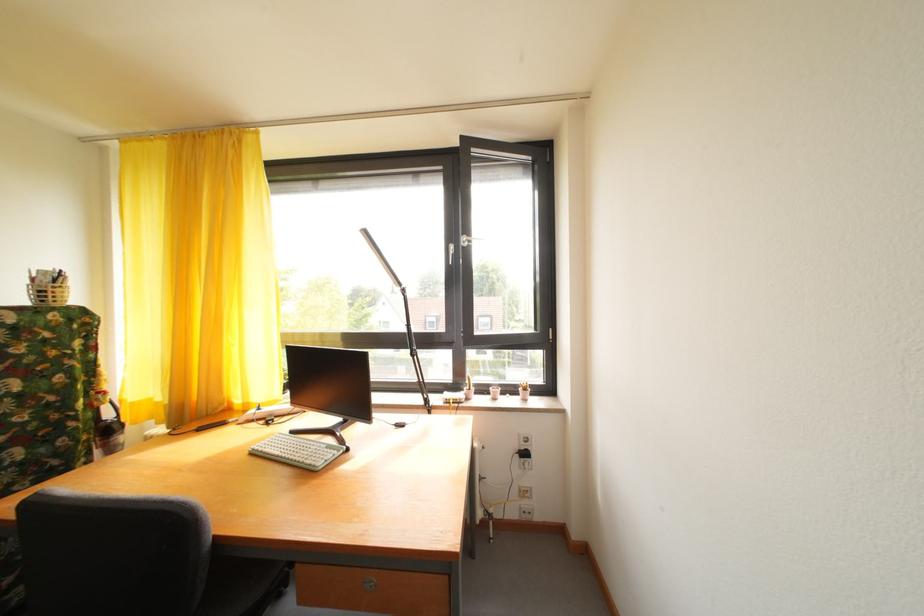
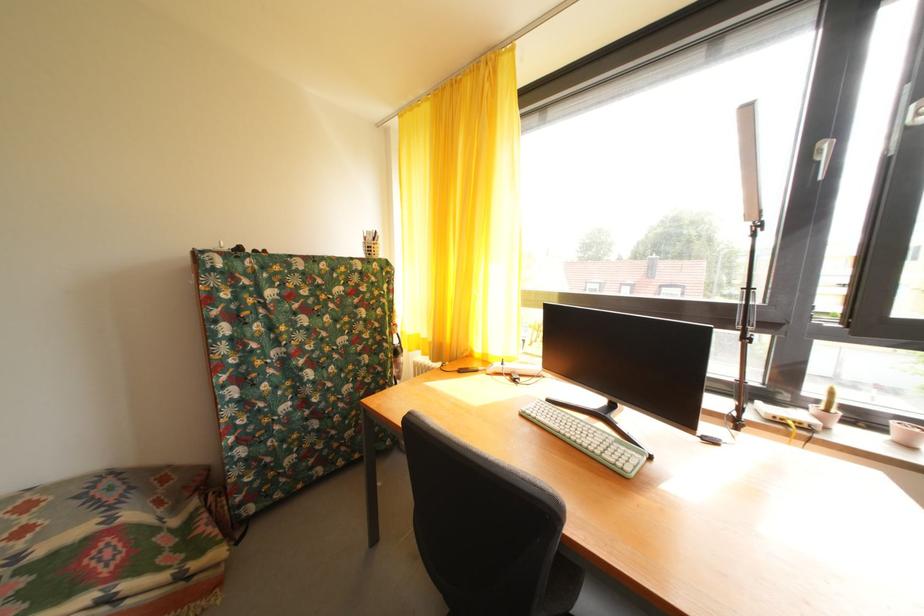
Where in the second image is the point corresponding to [499,395] from the first image?

(904, 430)